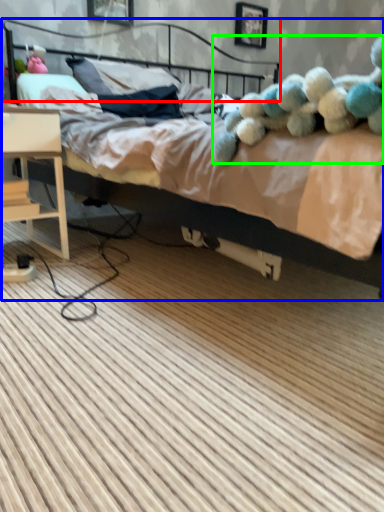
Question: Considering the real-world distances, which object is closest to headboard (highlighted by a red box)? bed (highlighted by a blue box) or teddy (highlighted by a green box).

Choices:
 (A) bed
 (B) teddy

Answer: (A)